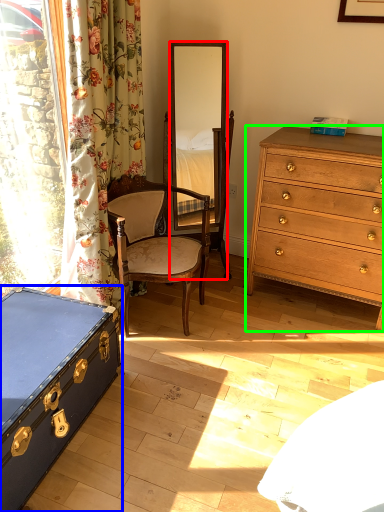
Question: Estimate the real-world distances between objects in this image. Which object is closer to mirror (highlighted by a red box), box (highlighted by a blue box) or chest of drawers (highlighted by a green box)?

Choices:
 (A) box
 (B) chest of drawers

Answer: (B)